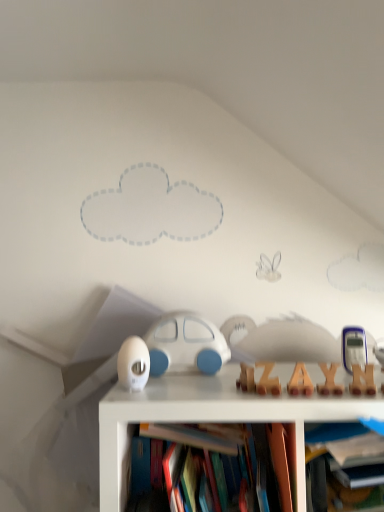
Question: In the image, is white matte egg at center, the first toy viewed from the left, on the left side or the right side of hardcover book at center?

Choices:
 (A) right
 (B) left

Answer: (B)

Question: In the image, is white matte egg at center, the 2th toy from the back, positioned in front of or behind hardcover book at center?

Choices:
 (A) front
 (B) behind

Answer: (B)

Question: Based on their relative distances, which object is farther from the white matte egg at center, which is the third toy from right to left?

Choices:
 (A) hardcover book at center
 (B) white matte car at center, which is the 3th toy from front to back
 (C) wooden letter at center, the third toy positioned from the left

Answer: (C)

Question: Estimate the real-world distances between objects in this image. Which object is closer to the white matte egg at center, the second toy from the front?

Choices:
 (A) wooden letter at center, the 3th toy in the back-to-front sequence
 (B) white matte car at center, acting as the second toy starting from the right
 (C) hardcover book at center

Answer: (B)